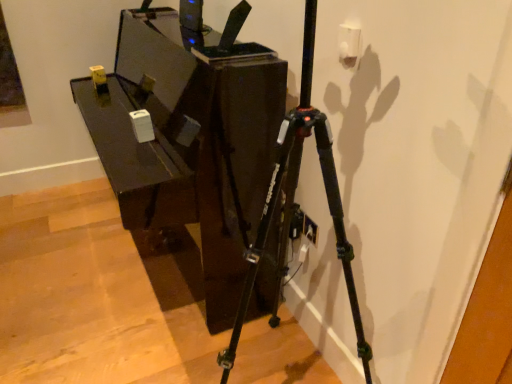
You are a GUI agent. You are given a task and a screenshot of the screen. Output one action in this format:
    pyautogui.click(x=<x>, y=<y>)
    Task: Click on the glossy dark wood table at center
    The height and width of the screenshot is (384, 512).
    Given the screenshot: What is the action you would take?
    pyautogui.click(x=190, y=139)

What do you see at coordinates (190, 139) in the screenshot? The height and width of the screenshot is (384, 512). I see `glossy dark wood table at center` at bounding box center [190, 139].

Where is `glossy dark wood table at center`? This screenshot has width=512, height=384. glossy dark wood table at center is located at coordinates (190, 139).